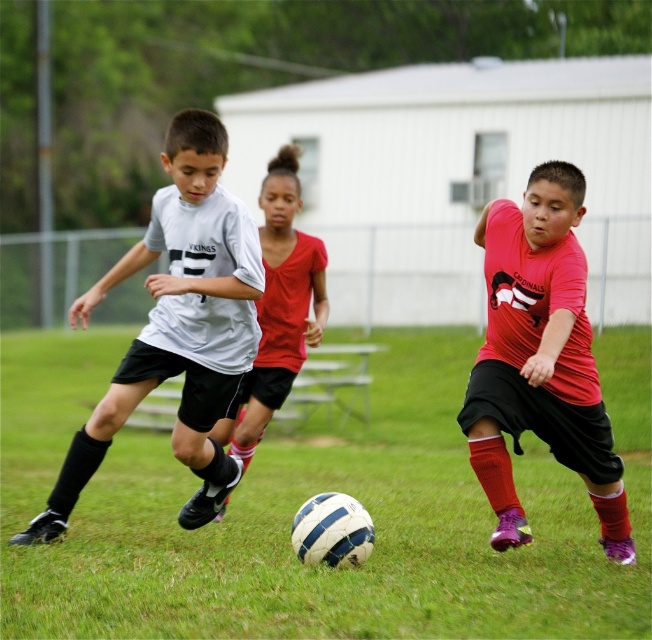
You are a referee observing the soccer game. You notice two players wearing red in the middle of the field. Which player is positioned lower on the field, the matte red jersey at center or the matte red shirt at center?

The matte red jersey at center is located below the matte red shirt at center, so the matte red jersey at center is positioned lower on the field.

You are a referee observing the soccer game and notice two players wearing red. One is wearing a matte red jersey at center and the other a matte red shirt at center. Which player has clothing with a smaller size?

The matte red jersey at center has a smaller size compared to the matte red shirt at center.